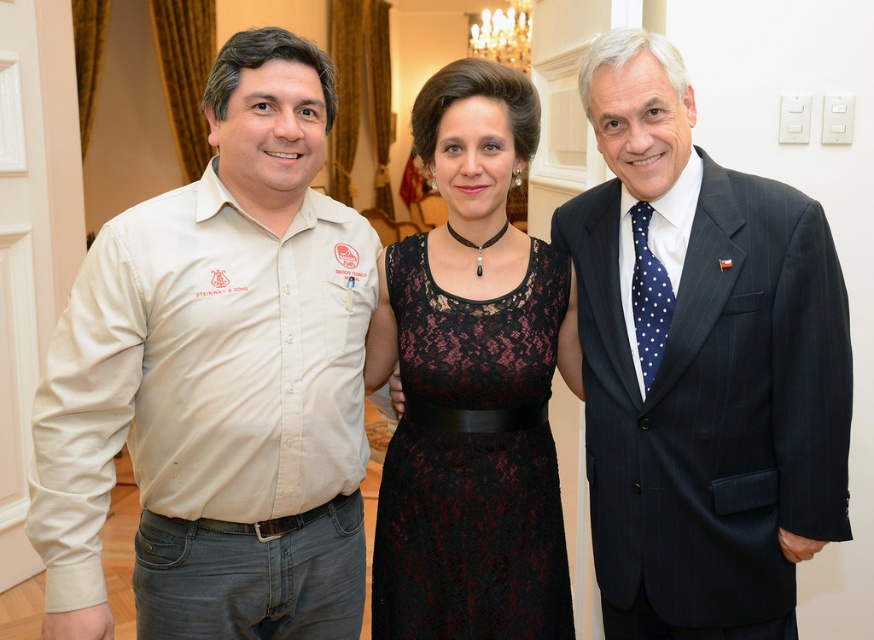
Can you confirm if dark blue pinstripe suit at center is shorter than black lace dress at center?

No.

Does point (711, 211) come in front of point (421, 355)?

Yes.

Is point (628, 326) positioned before point (529, 573)?

Yes.

What are the coordinates of `dark blue pinstripe suit at center` in the screenshot? It's located at (699, 365).

Does beige cotton shirt at left appear under black lace dress at center?

Actually, beige cotton shirt at left is above black lace dress at center.

Which is behind, point (167, 202) or point (519, 506)?

Point (519, 506)

Is point (198, 577) positioned after point (417, 561)?

No, (198, 577) is in front of (417, 561).

The height and width of the screenshot is (640, 874). What are the coordinates of `beige cotton shirt at left` in the screenshot? It's located at (218, 380).

Can you confirm if beige cotton shirt at left is thinner than dark blue pinstripe suit at center?

No.

I want to click on beige cotton shirt at left, so click(x=218, y=380).

Locate an element on the screen. beige cotton shirt at left is located at coordinates (218, 380).